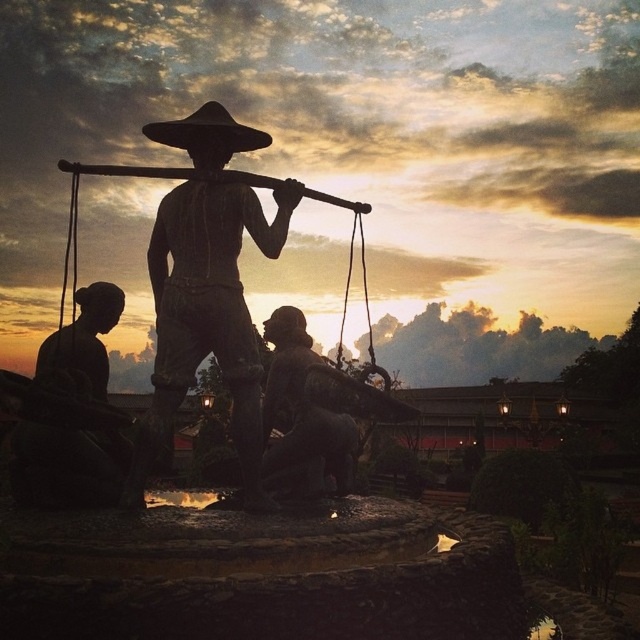
You are an art student analyzing the statue and hat in the sunset scene. Which object, the matte bronze statue at center or the black matte cowboy hat at upper center, has a greater height?

The black matte cowboy hat at upper center is taller than the matte bronze statue at center.

You are a painter standing 2 meters away from the matte bronze statue at center. You want to paint the black matte cowboy hat at upper center without moving. Can you reach it with your 2.5 meter long paintbrush?

The distance between the matte bronze statue at center and the black matte cowboy hat at upper center is 3.24 meters. Since you are 2 meters away from the statue, the total distance to the hat is 5.24 meters. Your paintbrush is only 2.5 meters long, so you cannot reach it.